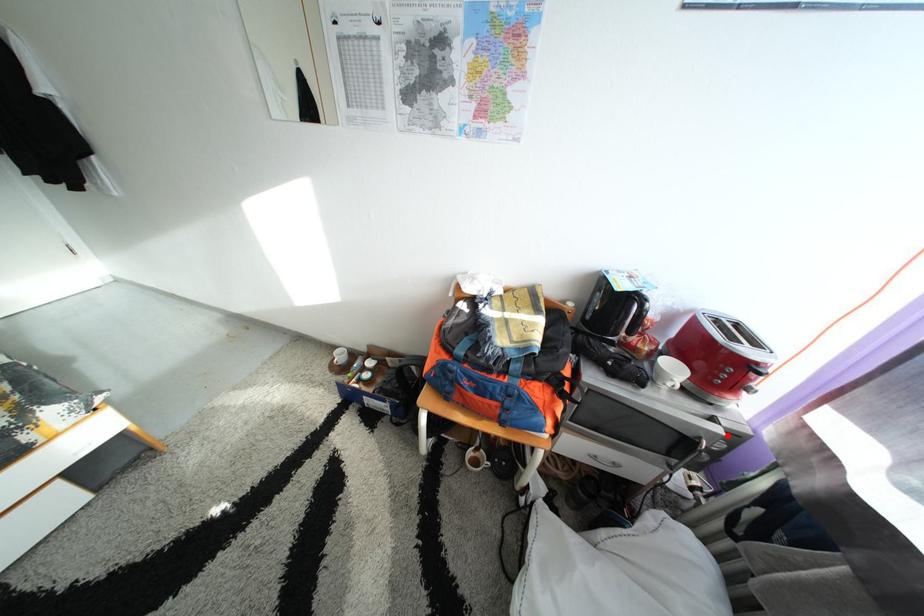
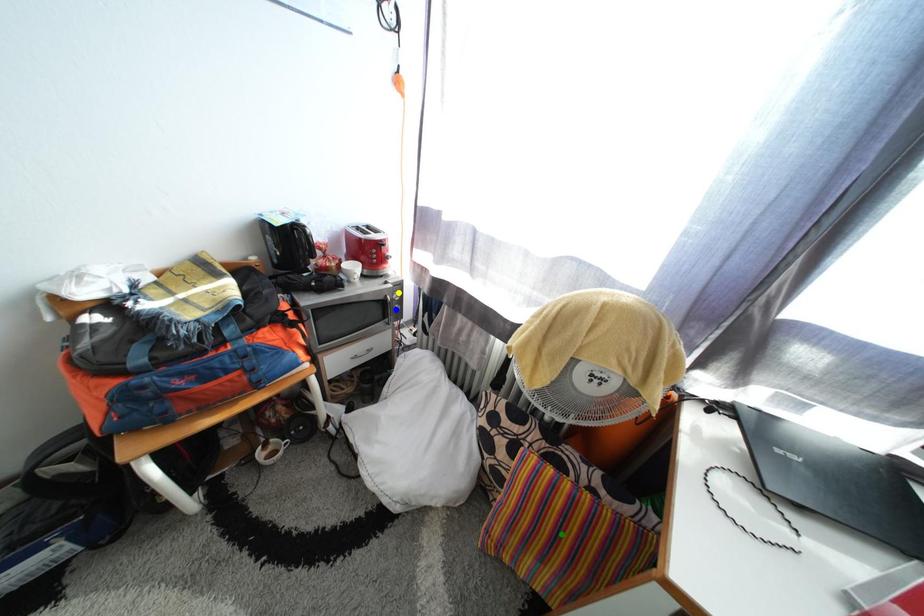
Question: I am providing you with two images of the same scene from different viewpoints. A red point is marked on the first image. You are given multiple points on the second image. Which mark in image 2 goes with the point in image 1?

Choices:
 (A) blue point
 (B) green point
 (C) yellow point

Answer: (C)